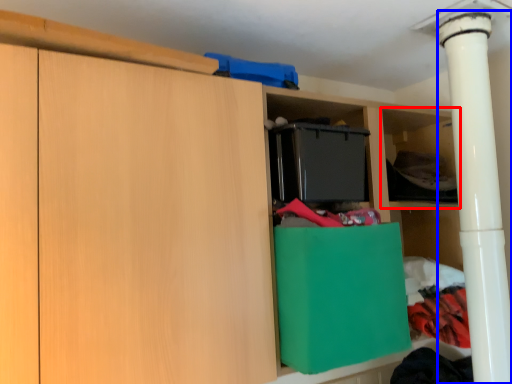
Question: Which of the following is the farthest to the observer, shelf (highlighted by a red box) or pillar (highlighted by a blue box)?

Choices:
 (A) shelf
 (B) pillar

Answer: (A)